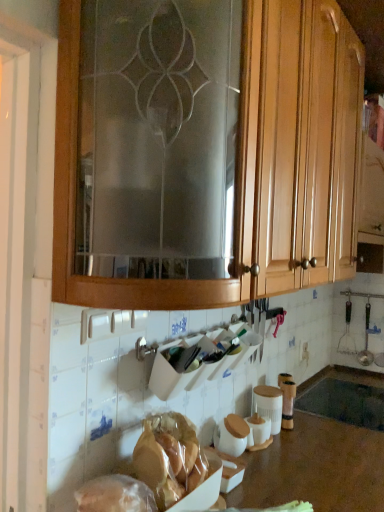
This screenshot has width=384, height=512. I want to click on brown polished wood at lower center, so click(x=318, y=459).

This screenshot has height=512, width=384. What do you see at coordinates (115, 495) in the screenshot?
I see `translucent plastic bag at lower left, which is counted as the 2th food, starting from the front` at bounding box center [115, 495].

In order to click on brown polished wood at lower center in this screenshot , I will do `click(318, 459)`.

From the image's perspective, is translucent plastic bag at lower left, which is the first food in back-to-front order, positioned above or below translucent plastic bag of bread at lower center, the first food viewed from the front?

Based on their image positions, translucent plastic bag at lower left, which is the first food in back-to-front order, is located above translucent plastic bag of bread at lower center, the first food viewed from the front.

Is translucent plastic bag at lower left, which is counted as the 2th food, starting from the front, completely or partially outside of translucent plastic bag of bread at lower center, which ranks as the second food in back-to-front order?

No, most part of translucent plastic bag at lower left, which is counted as the 2th food, starting from the front, lies within translucent plastic bag of bread at lower center, which ranks as the second food in back-to-front order.

Is translucent plastic bag at lower left, which is the first food in back-to-front order, looking in the opposite direction of translucent plastic bag of bread at lower center, the first food viewed from the front?

Correct, translucent plastic bag at lower left, which is the first food in back-to-front order, is looking away from translucent plastic bag of bread at lower center, the first food viewed from the front.

Does translucent plastic bag at lower left, which is counted as the 2th food, starting from the front, have a greater height compared to translucent plastic bag of bread at lower center, the first food viewed from the front?

Yes.

From a real-world perspective, which is physically below, matte brown jar at lower center or black matte sink at lower center?

black matte sink at lower center.

Find the location of a particular element. The height and width of the screenshot is (512, 384). pottery above the black matte sink at lower center (from the image's perspective) is located at coordinates (269, 405).

Would you say matte brown jar at lower center is outside black matte sink at lower center?

Yes, matte brown jar at lower center is located beyond the bounds of black matte sink at lower center.

Who is more distant, translucent plastic bag of bread at lower center, the first food viewed from the front, or wooden cabinet at upper center?

translucent plastic bag of bread at lower center, the first food viewed from the front.

From a real-world perspective, is translucent plastic bag of bread at lower center, the first food viewed from the front, physically located above or below wooden cabinet at upper center?

translucent plastic bag of bread at lower center, the first food viewed from the front, is situated lower than wooden cabinet at upper center in the real world.

How different are the orientations of translucent plastic bag of bread at lower center, the first food viewed from the front, and wooden cabinet at upper center in degrees?

There is a 0.417-degree angle between the facing directions of translucent plastic bag of bread at lower center, the first food viewed from the front, and wooden cabinet at upper center.

Could you tell me if translucent plastic bag of bread at lower center, which ranks as the second food in back-to-front order, is facing wooden cabinet at upper center?

No, translucent plastic bag of bread at lower center, which ranks as the second food in back-to-front order, is not facing towards wooden cabinet at upper center.

From the image's perspective, is wooden cabinet at upper center located above or below black matte sink at lower center?

Clearly, from the image's perspective, wooden cabinet at upper center is above black matte sink at lower center.

Is wooden cabinet at upper center wider or thinner than black matte sink at lower center?

Clearly, wooden cabinet at upper center has more width compared to black matte sink at lower center.

In terms of size, does wooden cabinet at upper center appear bigger or smaller than black matte sink at lower center?

Clearly, wooden cabinet at upper center is larger in size than black matte sink at lower center.

From the picture: Which object is positioned more to the left, wooden cabinet at upper center or black matte sink at lower center?

From the viewer's perspective, wooden cabinet at upper center appears more on the left side.

Does matte brown jar at lower center touch brown polished wood at lower center?

No, matte brown jar at lower center is not beside brown polished wood at lower center.

Does matte brown jar at lower center turn towards brown polished wood at lower center?

No, matte brown jar at lower center does not turn towards brown polished wood at lower center.

Which is correct: matte brown jar at lower center is inside brown polished wood at lower center, or outside of it?

matte brown jar at lower center exists outside the volume of brown polished wood at lower center.

Is point (84, 503) closer to camera compared to point (255, 408)?

Yes.

From a real-world perspective, is translucent plastic bag at lower left, which is the first food in back-to-front order, physically located above or below matte brown jar at lower center?

translucent plastic bag at lower left, which is the first food in back-to-front order, is situated higher than matte brown jar at lower center in the real world.

From the image's perspective, relative to matte brown jar at lower center, is translucent plastic bag at lower left, which is counted as the 2th food, starting from the front, above or below?

Clearly, from the image's perspective, translucent plastic bag at lower left, which is counted as the 2th food, starting from the front, is above matte brown jar at lower center.

Between matte brown jar at lower center and wooden cabinet at upper center, which one has smaller size?

With smaller size is matte brown jar at lower center.

Can you see matte brown jar at lower center touching wooden cabinet at upper center?

matte brown jar at lower center is not next to wooden cabinet at upper center, and they're not touching.

Is matte brown jar at lower center taller or shorter than wooden cabinet at upper center?

Considering their sizes, matte brown jar at lower center has less height than wooden cabinet at upper center.

Where is `food on the left of translucent plastic bag of bread at lower center, which ranks as the second food in back-to-front order`? food on the left of translucent plastic bag of bread at lower center, which ranks as the second food in back-to-front order is located at coordinates (115, 495).

Image resolution: width=384 pixels, height=512 pixels. Find the location of `pottery that is in front of the black matte sink at lower center`. pottery that is in front of the black matte sink at lower center is located at coordinates (269, 405).

Which object lies nearer to the anchor point brown polished wood at lower center, translucent plastic bag at lower left, which is counted as the 2th food, starting from the front, or translucent plastic bag of bread at lower center, which ranks as the second food in back-to-front order?

translucent plastic bag of bread at lower center, which ranks as the second food in back-to-front order, is closer to brown polished wood at lower center.

Which object lies nearer to the anchor point translucent plastic bag at lower left, which is the first food in back-to-front order, black matte sink at lower center or brown polished wood at lower center?

The object closer to translucent plastic bag at lower left, which is the first food in back-to-front order, is brown polished wood at lower center.

Considering their positions, is brown polished wood at lower center positioned further to translucent plastic bag at lower left, which is the first food in back-to-front order, than translucent plastic bag of bread at lower center, the first food viewed from the front?

brown polished wood at lower center.

Estimate the real-world distances between objects in this image. Which object is further from translucent plastic bag at lower left, which is counted as the 2th food, starting from the front, wooden cabinet at upper center or translucent plastic bag of bread at lower center, which ranks as the second food in back-to-front order?

Among the two, wooden cabinet at upper center is located further to translucent plastic bag at lower left, which is counted as the 2th food, starting from the front.

Estimate the real-world distances between objects in this image. Which object is further from brown polished wood at lower center, matte brown jar at lower center or wooden cabinet at upper center?

Based on the image, wooden cabinet at upper center appears to be further to brown polished wood at lower center.

Considering their positions, is brown polished wood at lower center positioned closer to wooden cabinet at upper center than black matte sink at lower center?

brown polished wood at lower center lies closer to wooden cabinet at upper center than the other object.

Which object lies further to the anchor point brown polished wood at lower center, translucent plastic bag at lower left, which is counted as the 2th food, starting from the front, or wooden cabinet at upper center?

wooden cabinet at upper center.

Looking at the image, which one is located further to translucent plastic bag of bread at lower center, which ranks as the second food in back-to-front order, matte brown jar at lower center or brown polished wood at lower center?

Based on the image, matte brown jar at lower center appears to be further to translucent plastic bag of bread at lower center, which ranks as the second food in back-to-front order.

I want to click on pottery between translucent plastic bag at lower left, which is counted as the 2th food, starting from the front, and black matte sink at lower center from left to right, so click(x=269, y=405).

Locate an element on the screen. pottery between brown polished wood at lower center and black matte sink at lower center from front to back is located at coordinates (269, 405).

The height and width of the screenshot is (512, 384). What are the coordinates of `food between translucent plastic bag at lower left, which is the first food in back-to-front order, and black matte sink at lower center` in the screenshot? It's located at (173, 462).

The width and height of the screenshot is (384, 512). In order to click on food between translucent plastic bag of bread at lower center, the first food viewed from the front, and matte brown jar at lower center from front to back in this screenshot , I will do `click(115, 495)`.